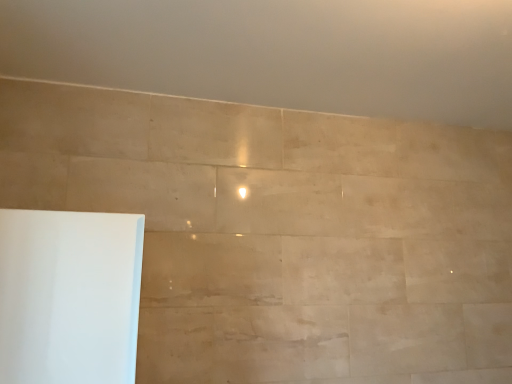
Image resolution: width=512 pixels, height=384 pixels. Identify the location of beige marble wall at upper center. (278, 52).

Measure the distance between point (x=352, y=41) and camera.

1.21 meters.

The height and width of the screenshot is (384, 512). Describe the element at coordinates (278, 52) in the screenshot. I see `beige marble wall at upper center` at that location.

Where is `beige marble wall at upper center`? beige marble wall at upper center is located at coordinates (278, 52).